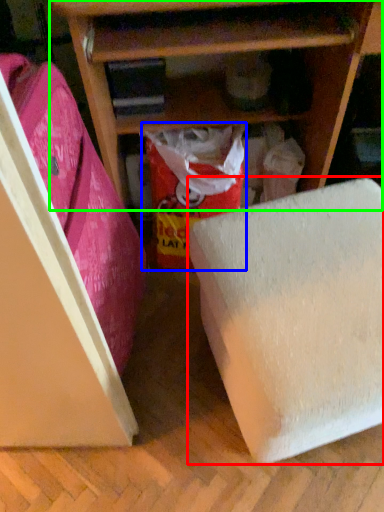
Question: Which object is positioned closest to furniture (highlighted by a red box)? Select from wrapping paper (highlighted by a blue box) and shelf (highlighted by a green box).

Choices:
 (A) wrapping paper
 (B) shelf

Answer: (A)